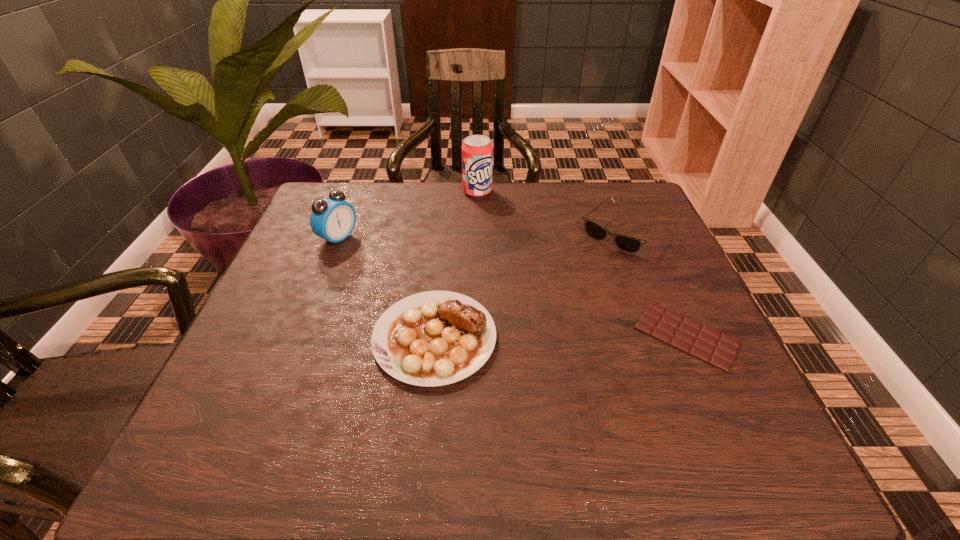
The height and width of the screenshot is (540, 960). I want to click on vacant area at the near edge, so click(x=444, y=390).

This screenshot has width=960, height=540. Find the location of `vacant space at the left edge`. vacant space at the left edge is located at coordinates (323, 255).

Locate an element on the screen. This screenshot has height=540, width=960. free location at the right edge is located at coordinates (643, 266).

In the image, there is a desktop. What are the coordinates of `vacant space at the far left corner` in the screenshot? It's located at (355, 198).

Where is `vacant space at the far right corner`? vacant space at the far right corner is located at coordinates (592, 206).

This screenshot has width=960, height=540. What are the coordinates of `free space between the shortest object and the tallest object` in the screenshot? It's located at (582, 264).

The width and height of the screenshot is (960, 540). Identify the location of free spot between the steak and the shortest object. (561, 336).

This screenshot has width=960, height=540. I want to click on blank region between the tallest object and the leftmost object, so click(408, 214).

Locate an element on the screen. The height and width of the screenshot is (540, 960). blank region between the shortest object and the tallest object is located at coordinates click(582, 264).

Locate an element on the screen. This screenshot has width=960, height=540. empty space between the tallest object and the fourth shortest object is located at coordinates pyautogui.click(x=408, y=214).